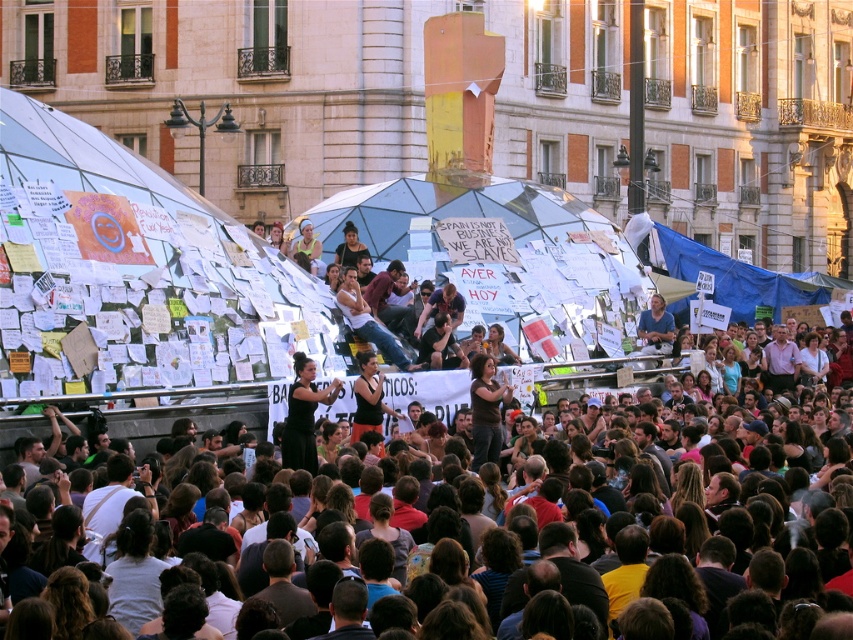
You are a photographer at the back of the crowd trying to capture a clear photo of both the dark brown hair at center and the black dress at center. Given that your camera has a maximum focus range of 6 meters, will you be able to fit both subjects into the frame without moving closer?

The dark brown hair at center and the black dress at center are 6.28 meters apart from each other. Since the camera can only focus up to 6 meters, the distance between them exceeds the focus range. Therefore, you cannot capture both subjects clearly in the same frame without moving closer.

You are standing at the center of the crowd and want to move towards the two points marked in the image. Which point, point [299,432] or point [668,346], is closer to you?

Point [299,432] is closer to you than point [668,346] because it is nearer in the image.